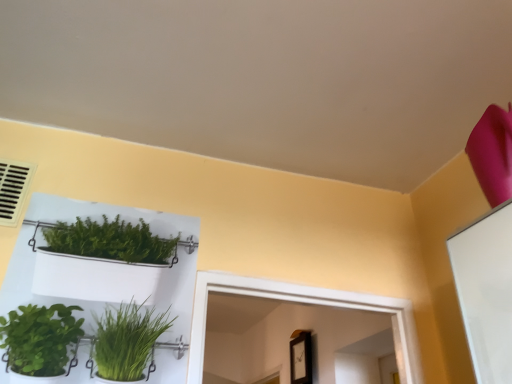
Question: Is white plastic shelf at upper left spatially inside beige plastic air conditioning at upper left, or outside of it?

Choices:
 (A) outside
 (B) inside

Answer: (A)

Question: Relative to beige plastic air conditioning at upper left, is white plastic shelf at upper left in front or behind?

Choices:
 (A) behind
 (B) front

Answer: (B)

Question: From a real-world perspective, relative to beige plastic air conditioning at upper left, is white plastic shelf at upper left vertically above or below?

Choices:
 (A) above
 (B) below

Answer: (B)

Question: Is point (10, 195) positioned closer to the camera than point (80, 216)?

Choices:
 (A) closer
 (B) farther

Answer: (A)

Question: Considering the positions of beige plastic air conditioning at upper left and white plastic shelf at upper left in the image, is beige plastic air conditioning at upper left taller or shorter than white plastic shelf at upper left?

Choices:
 (A) tall
 (B) short

Answer: (B)

Question: From the image's perspective, is beige plastic air conditioning at upper left located above or below white plastic shelf at upper left?

Choices:
 (A) below
 (B) above

Answer: (B)

Question: Is beige plastic air conditioning at upper left bigger or smaller than white plastic shelf at upper left?

Choices:
 (A) small
 (B) big

Answer: (A)